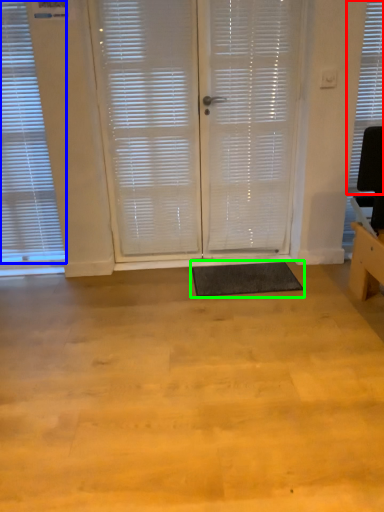
Question: Considering the real-world distances, which object is farthest from window blind (highlighted by a red box)? window blind (highlighted by a blue box) or yoga mat (highlighted by a green box)?

Choices:
 (A) window blind
 (B) yoga mat

Answer: (A)